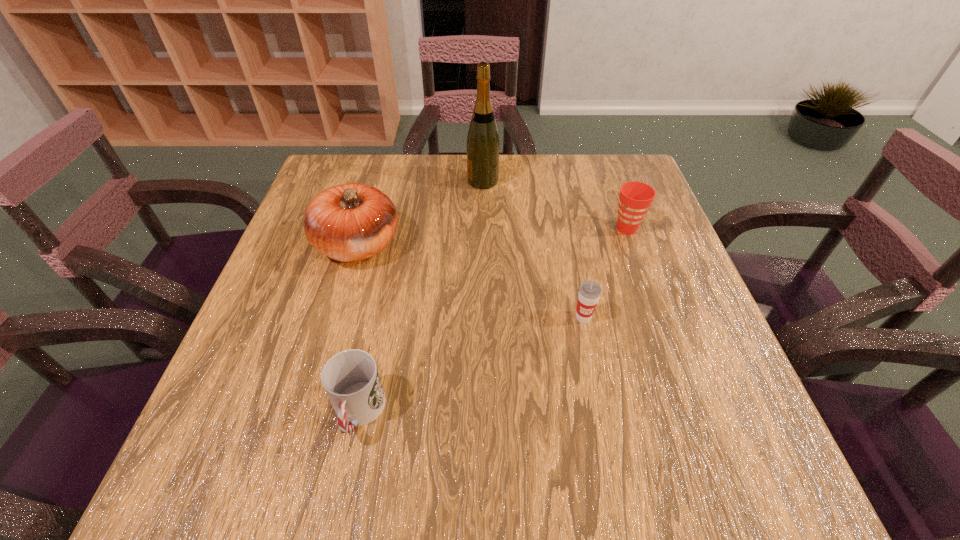
In the image, there is a desktop. Where is `free space at the near edge`? The image size is (960, 540). free space at the near edge is located at coordinates (433, 480).

Where is `free spot at the left edge of the desktop`? The image size is (960, 540). free spot at the left edge of the desktop is located at coordinates (307, 266).

Find the location of a particular element. This screenshot has height=540, width=960. blank space at the right edge of the desktop is located at coordinates (656, 310).

This screenshot has width=960, height=540. In order to click on free space at the far left corner of the desktop in this screenshot , I will do [x=370, y=157].

The image size is (960, 540). In order to click on free location at the far right corner in this screenshot , I will do `click(593, 162)`.

You are a GUI agent. You are given a task and a screenshot of the screen. Output one action in this format:
    pyautogui.click(x=<x>, y=<y>)
    Task: Click on the blank area at the near right corner
    This screenshot has width=960, height=540.
    Given the screenshot: What is the action you would take?
    pyautogui.click(x=720, y=439)

Identify the location of vacant space in between the tallest object and the fourth shortest object. (420, 213).

Find the location of a particular element. blank region between the tallest object and the rightmost object is located at coordinates coord(555,205).

You are a GUI agent. You are given a task and a screenshot of the screen. Output one action in this format:
    pyautogui.click(x=<x>, y=<y>)
    Task: Click on the vacant area between the farthest object and the nearest object
    Image resolution: width=960 pixels, height=540 pixels.
    Given the screenshot: What is the action you would take?
    pyautogui.click(x=420, y=297)

Image resolution: width=960 pixels, height=540 pixels. What are the coordinates of `free space between the second nearest object and the wine bottle` in the screenshot? It's located at (533, 249).